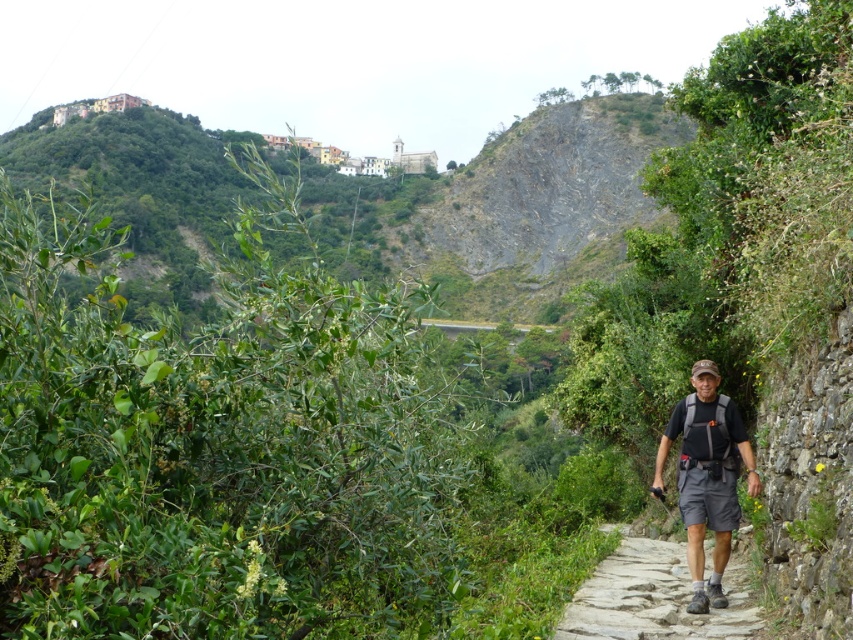
Question: Which point is farther from the camera taking this photo?

Choices:
 (A) (587, 616)
 (B) (689, 548)

Answer: (B)

Question: Can you confirm if gray stone path at center is bigger than dark gray fabric backpack at center?

Choices:
 (A) yes
 (B) no

Answer: (A)

Question: Can you confirm if gray stone path at center is positioned to the right of dark gray fabric backpack at center?

Choices:
 (A) no
 (B) yes

Answer: (A)

Question: Among these objects, which one is nearest to the camera?

Choices:
 (A) dark gray fabric backpack at center
 (B) gray stone path at center

Answer: (B)

Question: Can you confirm if gray stone path at center is positioned below dark gray fabric backpack at center?

Choices:
 (A) no
 (B) yes

Answer: (B)

Question: Which of the following is the closest to the observer?

Choices:
 (A) gray stone path at center
 (B) dark gray fabric backpack at center

Answer: (A)